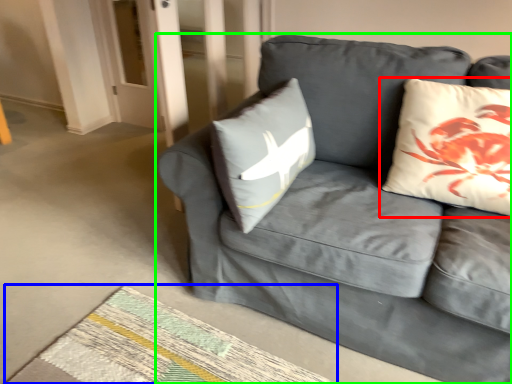
Question: Estimate the real-world distances between objects in this image. Which object is closer to pillow (highlighted by a red box), mat (highlighted by a blue box) or studio couch (highlighted by a green box)?

Choices:
 (A) mat
 (B) studio couch

Answer: (B)